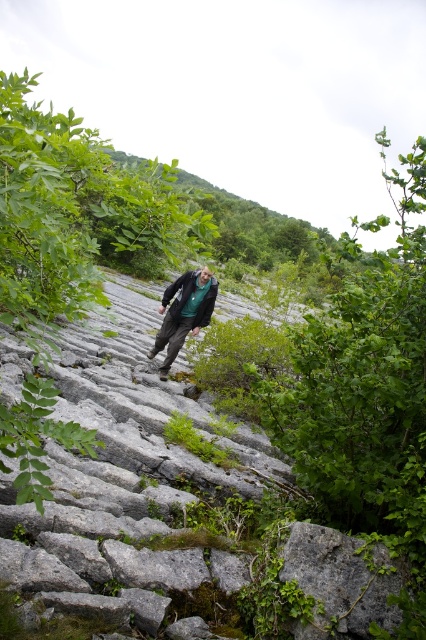
Question: Which object appears farthest from the camera in this image?

Choices:
 (A) dark green fabric jacket at center
 (B) gray rough stone at center

Answer: (A)

Question: Observing the image, what is the correct spatial positioning of gray rough stone at center in reference to dark green textured jacket at center?

Choices:
 (A) below
 (B) above

Answer: (A)

Question: Can you confirm if gray rough stone at center is positioned below dark green textured jacket at center?

Choices:
 (A) no
 (B) yes

Answer: (B)

Question: Is gray rough stone at center thinner than dark green fabric jacket at center?

Choices:
 (A) yes
 (B) no

Answer: (B)

Question: Which point appears farthest from the camera in this image?

Choices:
 (A) (157, 556)
 (B) (181, 305)
 (C) (181, 304)

Answer: (B)

Question: Which point is farther to the camera?

Choices:
 (A) dark green fabric jacket at center
 (B) dark green textured jacket at center

Answer: (B)